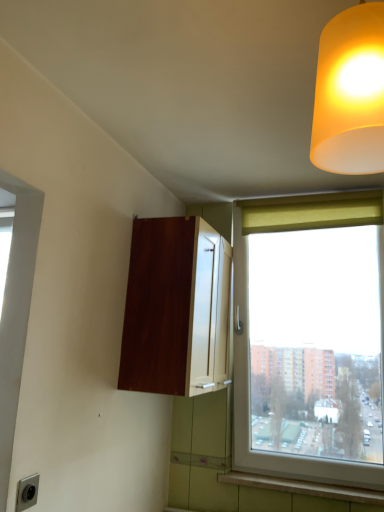
Question: Is matte gray electric outlet at lower left taller than matte yellow curtain at upper right?

Choices:
 (A) yes
 (B) no

Answer: (B)

Question: From the image's perspective, is matte gray electric outlet at lower left on matte yellow curtain at upper right?

Choices:
 (A) yes
 (B) no

Answer: (B)

Question: Is matte gray electric outlet at lower left shorter than matte yellow curtain at upper right?

Choices:
 (A) no
 (B) yes

Answer: (B)

Question: Does matte gray electric outlet at lower left have a smaller size compared to matte yellow curtain at upper right?

Choices:
 (A) no
 (B) yes

Answer: (B)

Question: Does matte gray electric outlet at lower left have a greater width compared to matte yellow curtain at upper right?

Choices:
 (A) yes
 (B) no

Answer: (B)

Question: Is matte yellow curtain at upper right wider or thinner than mahogany wood cabinet at center?

Choices:
 (A) thin
 (B) wide

Answer: (A)

Question: Is matte yellow curtain at upper right in front of or behind mahogany wood cabinet at center in the image?

Choices:
 (A) front
 (B) behind

Answer: (B)

Question: Considering the positions of matte yellow curtain at upper right and mahogany wood cabinet at center in the image, is matte yellow curtain at upper right bigger or smaller than mahogany wood cabinet at center?

Choices:
 (A) small
 (B) big

Answer: (A)

Question: From the image's perspective, is matte yellow curtain at upper right positioned above or below mahogany wood cabinet at center?

Choices:
 (A) above
 (B) below

Answer: (A)

Question: Is matte gray electric outlet at lower left bigger or smaller than mahogany wood cabinet at center?

Choices:
 (A) small
 (B) big

Answer: (A)

Question: Is matte gray electric outlet at lower left inside or outside of mahogany wood cabinet at center?

Choices:
 (A) inside
 (B) outside

Answer: (B)

Question: From a real-world perspective, is matte gray electric outlet at lower left above or below mahogany wood cabinet at center?

Choices:
 (A) below
 (B) above

Answer: (A)

Question: Is matte gray electric outlet at lower left to the left or to the right of mahogany wood cabinet at center in the image?

Choices:
 (A) left
 (B) right

Answer: (A)

Question: From the image's perspective, relative to matte gray electric outlet at lower left, is matte yellow lampshade at upper right above or below?

Choices:
 (A) above
 (B) below

Answer: (A)

Question: Is matte yellow lampshade at upper right spatially inside matte gray electric outlet at lower left, or outside of it?

Choices:
 (A) outside
 (B) inside

Answer: (A)